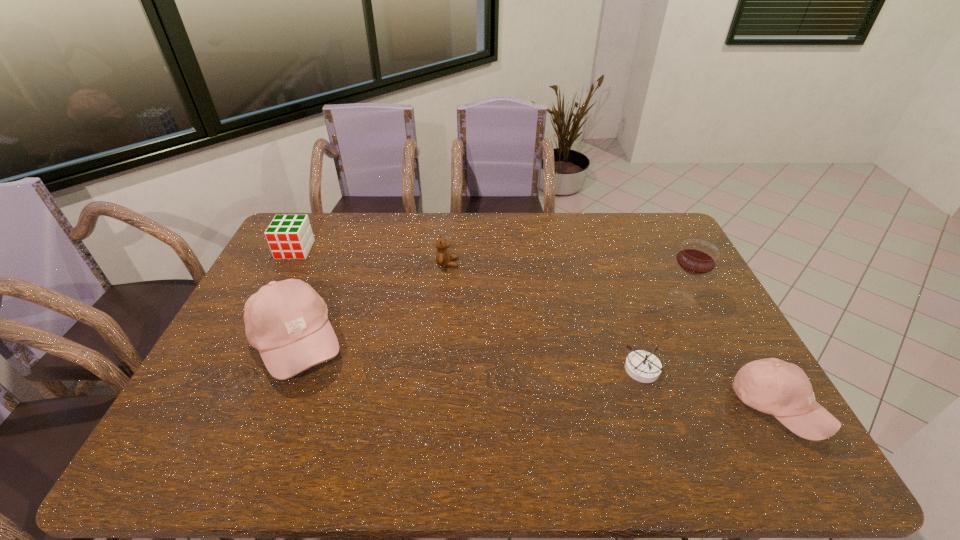
Locate an element on the screen. This screenshot has height=540, width=960. free spot located on the red face of the cube is located at coordinates (262, 313).

This screenshot has width=960, height=540. I want to click on vacant position located on the front of the wineglass, so click(x=737, y=411).

The height and width of the screenshot is (540, 960). Find the location of `object present at the far edge`. object present at the far edge is located at coordinates (289, 236).

Identify the location of object at the near edge. pos(773,386).

Where is `baseball cap situated at the left edge`? baseball cap situated at the left edge is located at coordinates (287, 321).

The image size is (960, 540). I want to click on cube at the left edge, so click(x=289, y=236).

Find the location of a particular element. Image resolution: width=960 pixels, height=540 pixels. baseball cap positioned at the right edge is located at coordinates (x=773, y=386).

Locate an element on the screen. The height and width of the screenshot is (540, 960). wineglass located in the right edge section of the desktop is located at coordinates (696, 257).

This screenshot has height=540, width=960. Find the location of `object situated at the far left corner`. object situated at the far left corner is located at coordinates (289, 236).

Find the location of `object that is at the near right corner`. object that is at the near right corner is located at coordinates (773, 386).